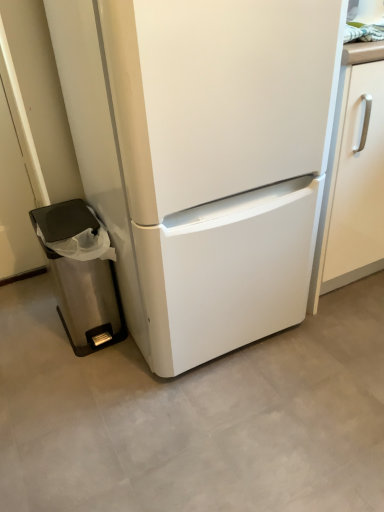
This screenshot has width=384, height=512. Identify the location of free space to the left of stainless steel trash can at left. (30, 338).